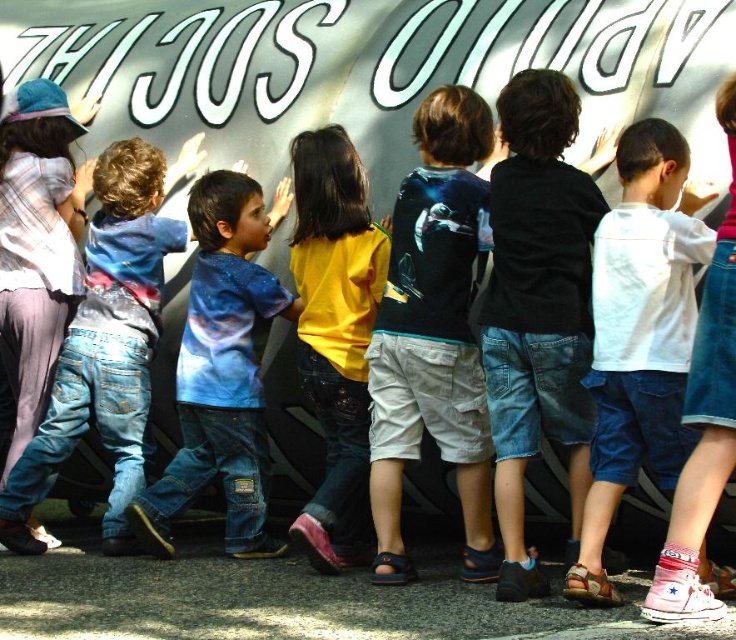
Looking at this image, which is above, white cotton shirt at center or plaid shirt at left?

Positioned higher is plaid shirt at left.

You are a GUI agent. You are given a task and a screenshot of the screen. Output one action in this format:
    pyautogui.click(x=<x>, y=<y>)
    Task: Click on the white cotton shirt at center
    
    Given the screenshot: What is the action you would take?
    pyautogui.click(x=640, y=333)

Who is more forward, (661, 168) or (21, 356)?

Point (661, 168) is in front.

What are the coordinates of `white cotton shirt at center` in the screenshot? It's located at (640, 333).

Can you confirm if dark blue t-shirt at center is wider than blue galaxy print shirt at center?

In fact, dark blue t-shirt at center might be narrower than blue galaxy print shirt at center.

Is dark blue t-shirt at center below blue galaxy print shirt at center?

No.

Identify the location of dark blue t-shirt at center. This screenshot has width=736, height=640. (434, 333).

I want to click on dark blue t-shirt at center, so click(x=434, y=333).

Does black cotton shirt at center have a smaller size compared to blue galaxy print shirt at center?

Yes, black cotton shirt at center is smaller than blue galaxy print shirt at center.

Is black cotton shirt at center above blue galaxy print shirt at center?

Yes, black cotton shirt at center is above blue galaxy print shirt at center.

Does point (553, 122) lie in front of point (208, 241)?

That is True.

Identify the location of black cotton shirt at center. Image resolution: width=736 pixels, height=640 pixels. (537, 308).